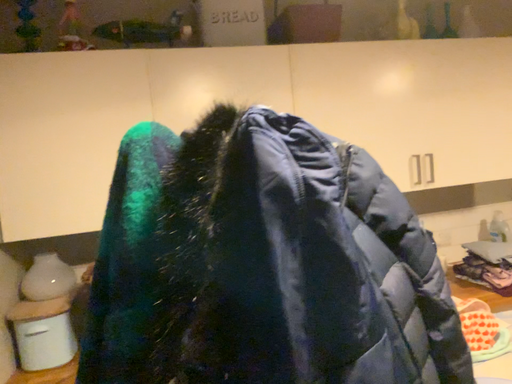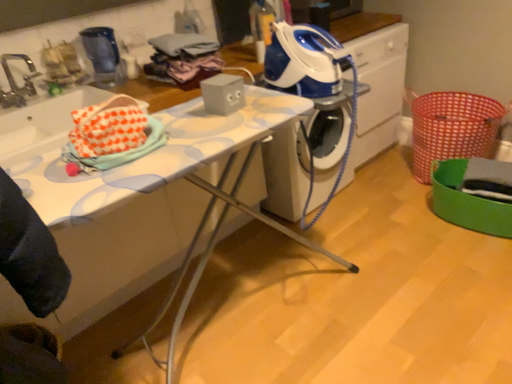
Question: How did the camera likely rotate when shooting the video?

Choices:
 (A) rotated right
 (B) rotated left

Answer: (A)